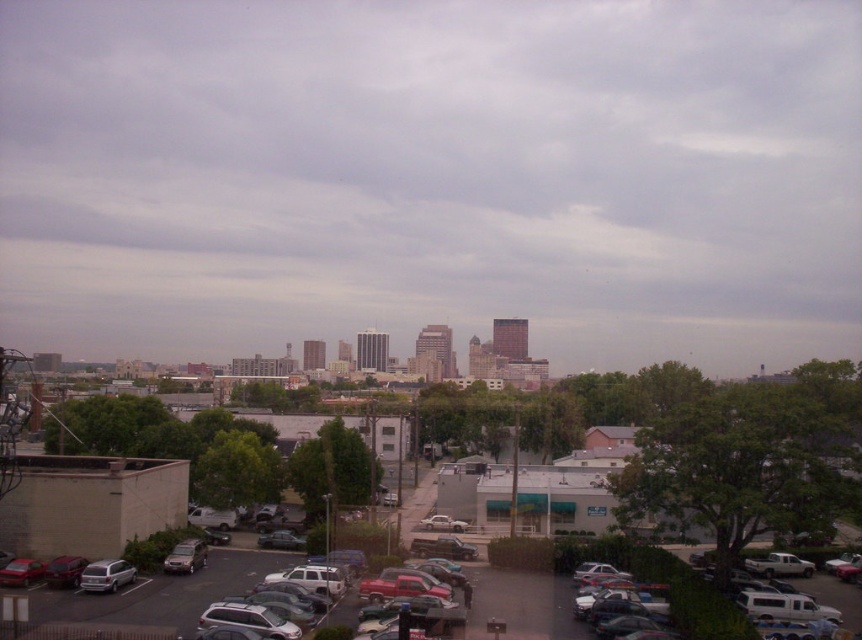
Between matte silver sedan at lower right and silver metallic van at lower left, which one appears on the right side from the viewer's perspective?

matte silver sedan at lower right

Is matte silver sedan at lower right shorter than silver metallic van at lower left?

In fact, matte silver sedan at lower right may be taller than silver metallic van at lower left.

Measure the distance between point (613,582) and camera.

Point (613,582) and camera are 197.53 feet apart from each other.

You are a GUI agent. You are given a task and a screenshot of the screen. Output one action in this format:
    pyautogui.click(x=<x>, y=<y>)
    Task: Click on the matte silver sedan at lower right
    This screenshot has height=640, width=862.
    Given the screenshot: What is the action you would take?
    pyautogui.click(x=622, y=605)

Between point (542, 595) and point (656, 620), which one is positioned behind?

Point (542, 595)

Which of these two, metallic silver cars at lower center or matte silver sedan at lower right, stands shorter?

matte silver sedan at lower right

Is point (544, 604) positioned after point (632, 588)?

That is True.

The width and height of the screenshot is (862, 640). Identify the location of metallic silver cars at lower center. (161, 593).

Between point (573, 608) and point (192, 545), which one is positioned behind?

The point (192, 545) is more distant.

Between point (638, 612) and point (202, 541), which one is positioned in front?

Point (638, 612)

Which is behind, point (626, 621) or point (172, 560)?

The point (172, 560) is more distant.

You are a GUI agent. You are given a task and a screenshot of the screen. Output one action in this format:
    pyautogui.click(x=<x>, y=<y>)
    Task: Click on the matte silver sedan at lower right
    This screenshot has width=862, height=640.
    Given the screenshot: What is the action you would take?
    pyautogui.click(x=622, y=605)